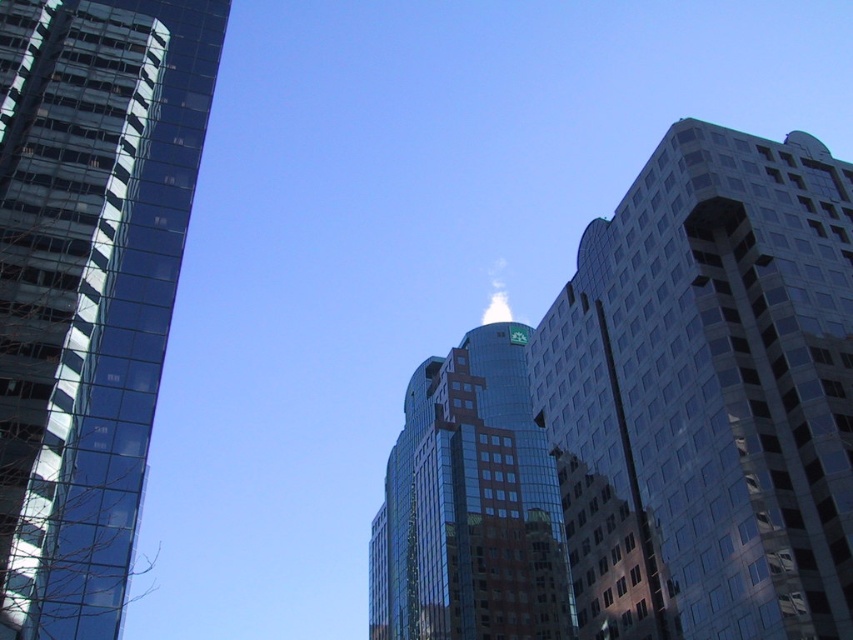
Question: Among these points, which one is nearest to the camera?

Choices:
 (A) (564, 612)
 (B) (848, 611)

Answer: (B)

Question: Does glassy blue skyscraper at right appear under shiny glass skyscraper at left?

Choices:
 (A) yes
 (B) no

Answer: (A)

Question: Based on their relative distances, which object is farther from the glassy reflective building at center?

Choices:
 (A) shiny glass skyscraper at left
 (B) glassy blue skyscraper at right

Answer: (A)

Question: Which point is closer to the camera?

Choices:
 (A) (770, 458)
 (B) (62, 630)

Answer: (B)

Question: Does glassy blue skyscraper at right appear on the right side of glassy reflective building at center?

Choices:
 (A) no
 (B) yes

Answer: (B)

Question: Can you confirm if glassy blue skyscraper at right is positioned above shiny glass skyscraper at left?

Choices:
 (A) yes
 (B) no

Answer: (B)